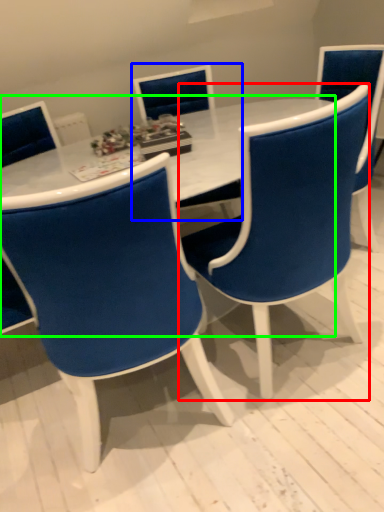
Question: Estimate the real-world distances between objects in this image. Which object is farther from chair (highlighted by a red box), chair (highlighted by a blue box) or table (highlighted by a green box)?

Choices:
 (A) chair
 (B) table

Answer: (A)